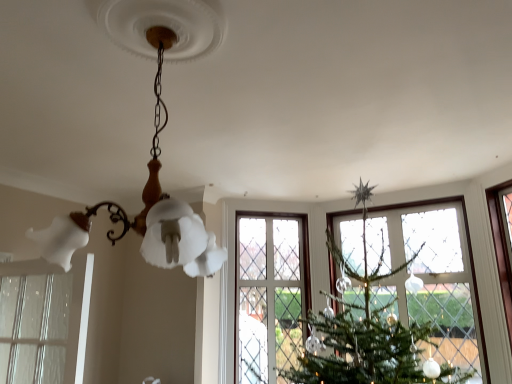
Question: Considering the relative sizes of matte white glass chandelier at upper center and clear glass window at lower left in the image provided, is matte white glass chandelier at upper center wider than clear glass window at lower left?

Choices:
 (A) yes
 (B) no

Answer: (A)

Question: Would you say clear glass window at lower left is part of matte white glass chandelier at upper center's contents?

Choices:
 (A) no
 (B) yes

Answer: (A)

Question: Is matte white glass chandelier at upper center facing towards clear glass window at lower left?

Choices:
 (A) yes
 (B) no

Answer: (A)

Question: Is matte white glass chandelier at upper center shorter than clear glass window at lower left?

Choices:
 (A) yes
 (B) no

Answer: (B)

Question: Does matte white glass chandelier at upper center appear on the right side of clear glass window at lower left?

Choices:
 (A) yes
 (B) no

Answer: (A)

Question: From the image's perspective, does matte white glass chandelier at upper center appear lower than clear glass window at lower left?

Choices:
 (A) no
 (B) yes

Answer: (A)

Question: Is clear glass window at lower left turned away from matte white glass chandelier at upper center?

Choices:
 (A) no
 (B) yes

Answer: (A)

Question: Is clear glass window at lower left placed right next to matte white glass chandelier at upper center?

Choices:
 (A) yes
 (B) no

Answer: (B)

Question: Is clear glass window at lower left smaller than matte white glass chandelier at upper center?

Choices:
 (A) no
 (B) yes

Answer: (B)

Question: Considering the relative sizes of clear glass window at lower left and matte white glass chandelier at upper center in the image provided, is clear glass window at lower left thinner than matte white glass chandelier at upper center?

Choices:
 (A) yes
 (B) no

Answer: (A)

Question: From a real-world perspective, does clear glass window at lower left sit lower than matte white glass chandelier at upper center?

Choices:
 (A) yes
 (B) no

Answer: (A)

Question: Would you consider clear glass window at lower left to be distant from matte white glass chandelier at upper center?

Choices:
 (A) yes
 (B) no

Answer: (A)

Question: Do you think matte white glass chandelier at upper center is within clear glass window at lower left, or outside of it?

Choices:
 (A) outside
 (B) inside

Answer: (A)